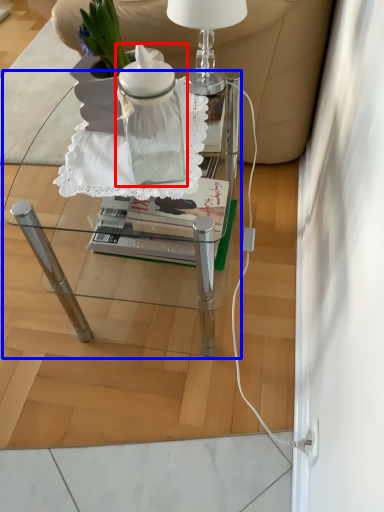
Question: Which of the following is the farthest to the observer, bottle (highlighted by a red box) or table (highlighted by a blue box)?

Choices:
 (A) bottle
 (B) table

Answer: (B)